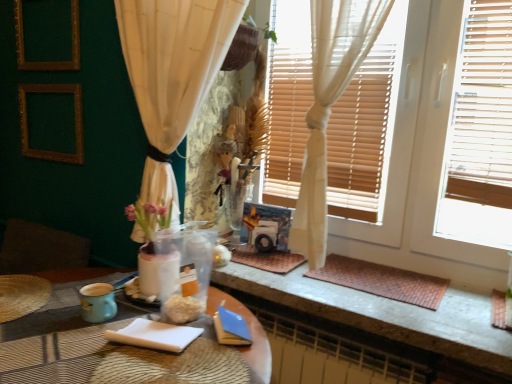
Identify the location of free location to the left of teal ceramic mug at lower left. (51, 316).